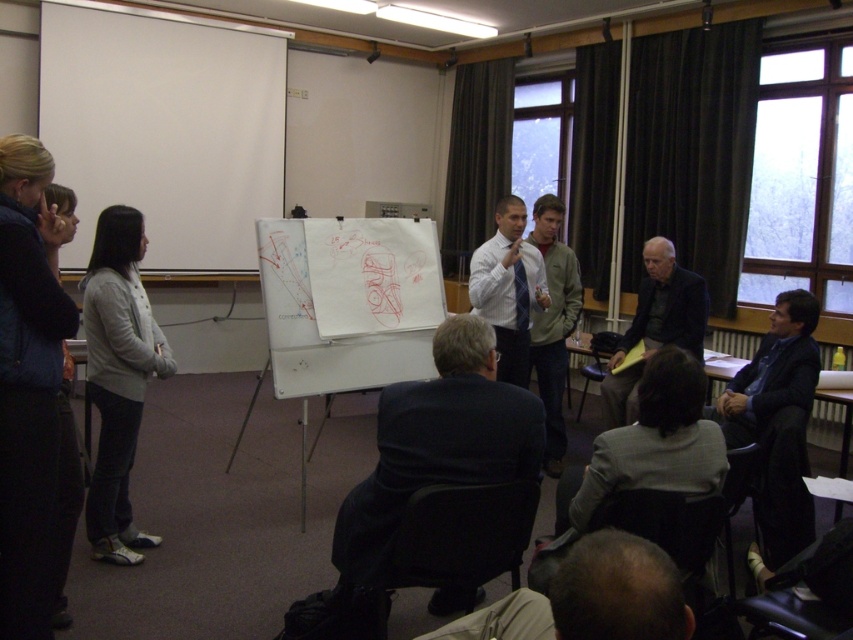
Question: Estimate the real-world distances between objects in this image. Which object is closer to the dark blue suit at center?

Choices:
 (A) greenish-gray jacket at center
 (B) white shirt at center
 (C) white fabric jacket at left
 (D) dark brown hair at lower center

Answer: (D)

Question: Among these points, which one is farthest from the camera?

Choices:
 (A) (508, 216)
 (B) (329, 384)
 (C) (560, 429)
 (D) (100, 467)

Answer: (C)

Question: Does white shirt at center appear on the right side of greenish-gray jacket at center?

Choices:
 (A) no
 (B) yes

Answer: (A)

Question: Is white fabric jacket at left to the right of dark brown hair at lower center from the viewer's perspective?

Choices:
 (A) no
 (B) yes

Answer: (A)

Question: Can you confirm if white fabric jacket at left is thinner than greenish-gray jacket at center?

Choices:
 (A) no
 (B) yes

Answer: (A)

Question: Based on their relative distances, which object is nearer to the white shirt at center?

Choices:
 (A) white fabric jacket at left
 (B) dark gray sweater at center
 (C) dark blue suit at center
 (D) greenish-gray jacket at center

Answer: (D)